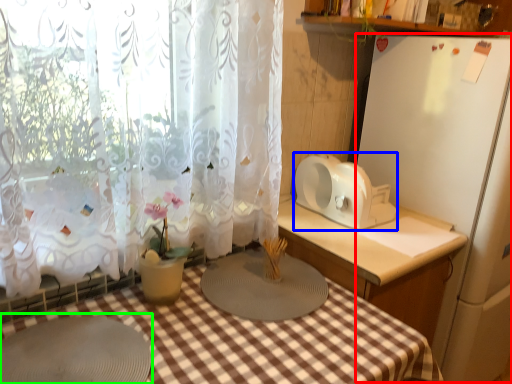
Question: Estimate the real-world distances between objects in this image. Which object is closer to appliance (highlighted by a red box), appliance (highlighted by a blue box) or round table (highlighted by a green box)?

Choices:
 (A) appliance
 (B) round table

Answer: (A)